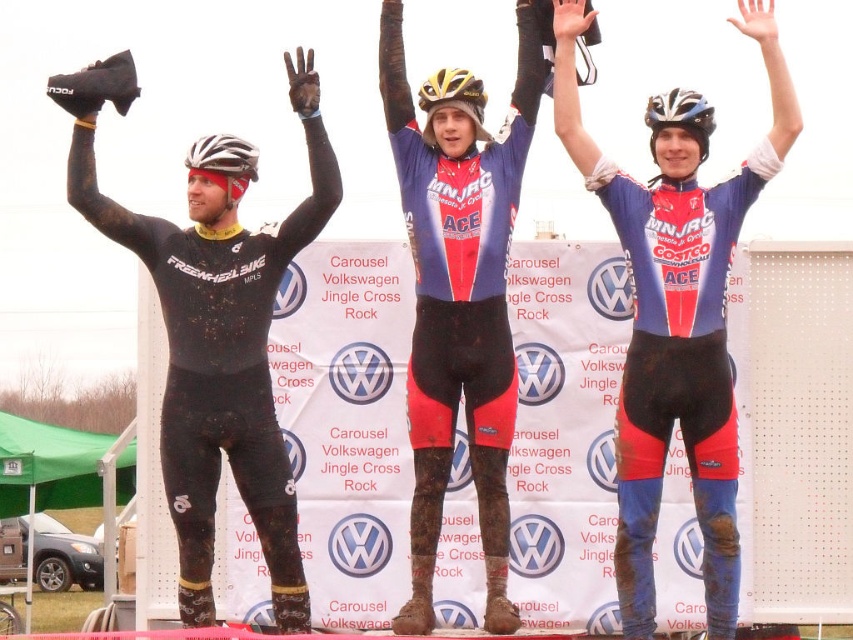
Question: Is matte blue and red cycling suit at center below white matte bicycle helmet at upper left?

Choices:
 (A) no
 (B) yes

Answer: (B)

Question: Is yellow matte bicycle helmet at center thinner than shiny blue helmet at center?

Choices:
 (A) yes
 (B) no

Answer: (A)

Question: Which object is closer to the camera taking this photo?

Choices:
 (A) matte black suit at left
 (B) matte blue and red cycling suit at center
 (C) blue matte cycling suit at center
 (D) white matte bicycle helmet at upper left

Answer: (B)

Question: Which object is the closest to the matte black suit at left?

Choices:
 (A) matte blue and red cycling suit at center
 (B) white matte bicycle helmet at upper left
 (C) shiny blue helmet at center

Answer: (B)

Question: Is white matte bicycle helmet at upper left below shiny blue helmet at center?

Choices:
 (A) no
 (B) yes

Answer: (B)

Question: Which is farther from the matte black suit at left?

Choices:
 (A) yellow matte bicycle helmet at center
 (B) white matte bicycle helmet at upper left

Answer: (A)